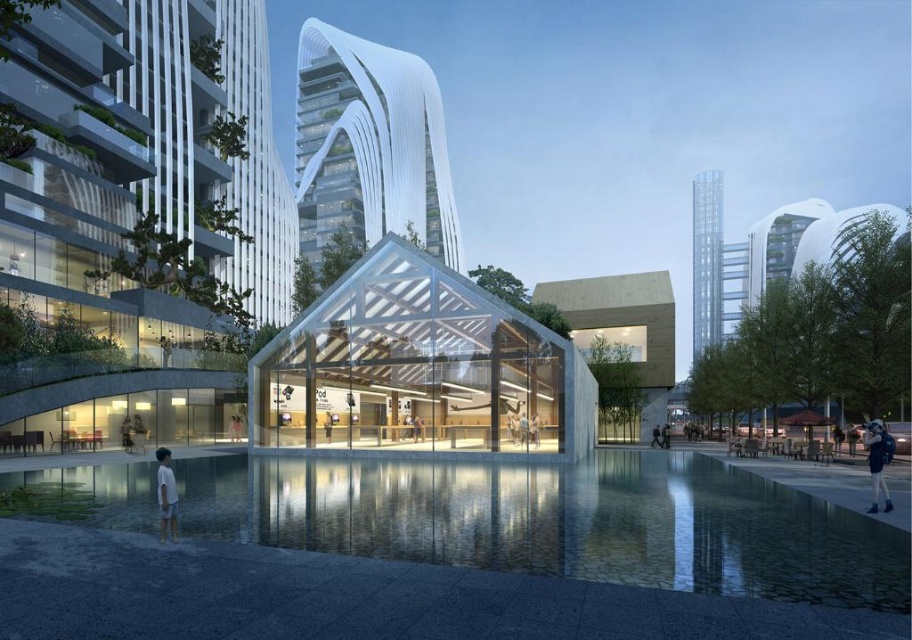
Question: Can you confirm if transparent glass tower at right is positioned above yellow fabric bag at center?

Choices:
 (A) yes
 (B) no

Answer: (A)

Question: Is clear glass pool at lower center further to camera compared to transparent glass tower at right?

Choices:
 (A) yes
 (B) no

Answer: (B)

Question: From the image, what is the correct spatial relationship of clear glass pool at lower center in relation to white cotton shorts at lower left?

Choices:
 (A) right
 (B) left

Answer: (A)

Question: Which object is the farthest from the denim jacket at lower right?

Choices:
 (A) clear glass pool at lower center
 (B) yellow fabric bag at center
 (C) transparent glass tower at right

Answer: (C)

Question: Among these objects, which one is nearest to the camera?

Choices:
 (A) denim jacket at lower right
 (B) yellow fabric bag at center
 (C) clear glass pool at lower center

Answer: (C)

Question: Among these objects, which one is farthest from the camera?

Choices:
 (A) white cotton shorts at lower left
 (B) transparent glass tower at right
 (C) white glass tower at upper center
 (D) denim jacket at lower right

Answer: (B)